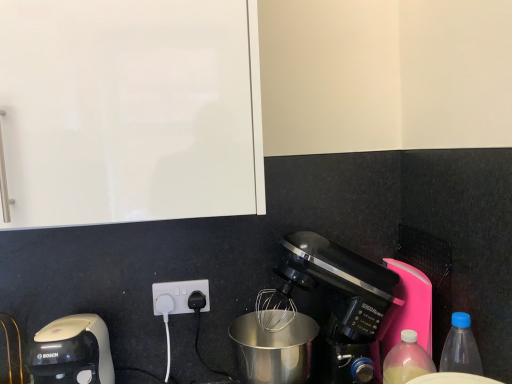
Question: Is translucent plastic bottle at lower right, the 1th bottle when ordered from left to right, not close to black plastic power plugs and sockets at lower center?

Choices:
 (A) no
 (B) yes

Answer: (A)

Question: Is the position of translucent plastic bottle at lower right, the 1th bottle when ordered from left to right, more distant than that of black plastic power plugs and sockets at lower center?

Choices:
 (A) yes
 (B) no

Answer: (B)

Question: Can you confirm if translucent plastic bottle at lower right, the second bottle from the right, is smaller than black plastic power plugs and sockets at lower center?

Choices:
 (A) no
 (B) yes

Answer: (A)

Question: Would you say black plastic power plugs and sockets at lower center is part of translucent plastic bottle at lower right, the 1th bottle when ordered from left to right,'s contents?

Choices:
 (A) no
 (B) yes

Answer: (A)

Question: Does translucent plastic bottle at lower right, the second bottle from the right, have a lesser width compared to black plastic power plugs and sockets at lower center?

Choices:
 (A) no
 (B) yes

Answer: (A)

Question: Is black plastic power plugs and sockets at lower center wider or thinner than matte black coffee maker at lower right, the second coffee maker viewed from the left?

Choices:
 (A) thin
 (B) wide

Answer: (A)

Question: Considering their positions, is black plastic power plugs and sockets at lower center located in front of or behind matte black coffee maker at lower right, which ranks as the 1th coffee maker in right-to-left order?

Choices:
 (A) front
 (B) behind

Answer: (B)

Question: Visually, is black plastic power plugs and sockets at lower center positioned to the left or to the right of matte black coffee maker at lower right, the second coffee maker viewed from the left?

Choices:
 (A) right
 (B) left

Answer: (B)

Question: From a real-world perspective, is black plastic power plugs and sockets at lower center above or below matte black coffee maker at lower right, the second coffee maker viewed from the left?

Choices:
 (A) above
 (B) below

Answer: (A)

Question: Visually, is black plastic power plugs and sockets at lower center positioned to the left or to the right of translucent plastic bottle at lower right, the 1th bottle when ordered from left to right?

Choices:
 (A) left
 (B) right

Answer: (A)

Question: Considering the positions of black plastic power plugs and sockets at lower center and translucent plastic bottle at lower right, the second bottle from the right, in the image, is black plastic power plugs and sockets at lower center wider or thinner than translucent plastic bottle at lower right, the second bottle from the right,?

Choices:
 (A) wide
 (B) thin

Answer: (B)

Question: From their relative heights in the image, would you say black plastic power plugs and sockets at lower center is taller or shorter than translucent plastic bottle at lower right, the 1th bottle when ordered from left to right?

Choices:
 (A) tall
 (B) short

Answer: (B)

Question: Considering the positions of point (158, 296) and point (400, 357), is point (158, 296) closer or farther from the camera than point (400, 357)?

Choices:
 (A) farther
 (B) closer

Answer: (A)

Question: Does point (391, 354) appear closer or farther from the camera than point (355, 289)?

Choices:
 (A) closer
 (B) farther

Answer: (A)

Question: From a real-world perspective, is translucent plastic bottle at lower right, the second bottle from the right, above or below matte black coffee maker at lower right, the second coffee maker viewed from the left?

Choices:
 (A) below
 (B) above

Answer: (A)